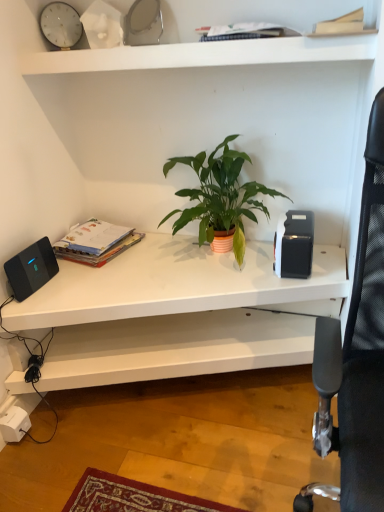
Locate an element on the screen. The width and height of the screenshot is (384, 512). empty space that is to the right of black matte speaker at left is located at coordinates (70, 283).